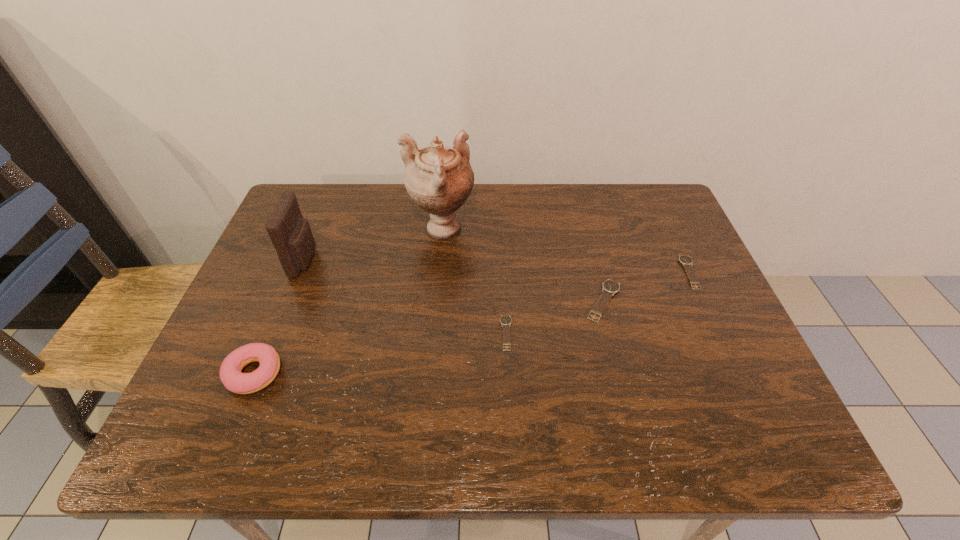
Locate an element on the screen. doughnut located at the left edge is located at coordinates (231, 376).

Locate an element on the screen. The width and height of the screenshot is (960, 540). object located at the right edge is located at coordinates (685, 260).

Identify the location of object that is positioned at the near left corner. (231, 376).

This screenshot has height=540, width=960. In order to click on vacant area at the far edge of the desktop in this screenshot , I will do `click(403, 193)`.

Locate an element on the screen. This screenshot has width=960, height=540. vacant space at the near edge of the desktop is located at coordinates (520, 375).

In the image, there is a desktop. Where is `vacant space at the right edge`? This screenshot has height=540, width=960. vacant space at the right edge is located at coordinates (709, 305).

You are a GUI agent. You are given a task and a screenshot of the screen. Output one action in this format:
    pyautogui.click(x=<x>, y=<y>)
    Task: Click on the vacant space at the far right corner
    Image resolution: width=960 pixels, height=540 pixels.
    Given the screenshot: What is the action you would take?
    pyautogui.click(x=662, y=200)

Find the location of a particular element. This screenshot has height=540, width=960. vacant space that is in between the leftmost watch and the doughnut is located at coordinates (380, 353).

You are a GUI agent. You are given a task and a screenshot of the screen. Output one action in this format:
    pyautogui.click(x=<x>, y=<y>)
    Task: Click on the free space between the second tallest object and the leftmost watch
    This screenshot has height=540, width=960.
    Given the screenshot: What is the action you would take?
    pyautogui.click(x=405, y=296)

Where is `empty space between the third tallest object and the third object from left to right`? empty space between the third tallest object and the third object from left to right is located at coordinates (348, 302).